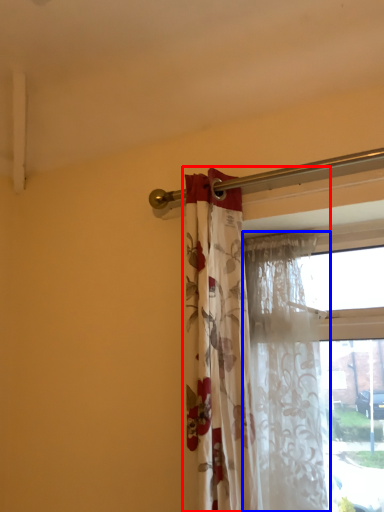
Question: Which point is further to the camera, curtain (highlighted by a red box) or curtain (highlighted by a blue box)?

Choices:
 (A) curtain
 (B) curtain

Answer: (B)